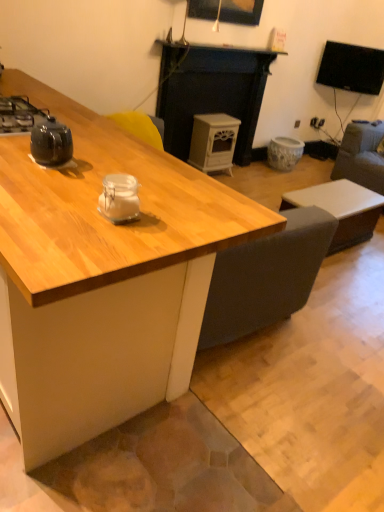
Locate an element on the screen. vacant region above black glossy tv at upper right (from a real-world perspective) is located at coordinates [366, 36].